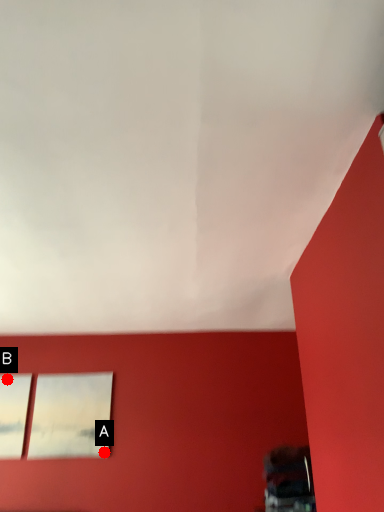
Question: Two points are circled on the image, labeled by A and B beside each circle. Which point is closer to the camera?

Choices:
 (A) A is closer
 (B) B is closer

Answer: (A)